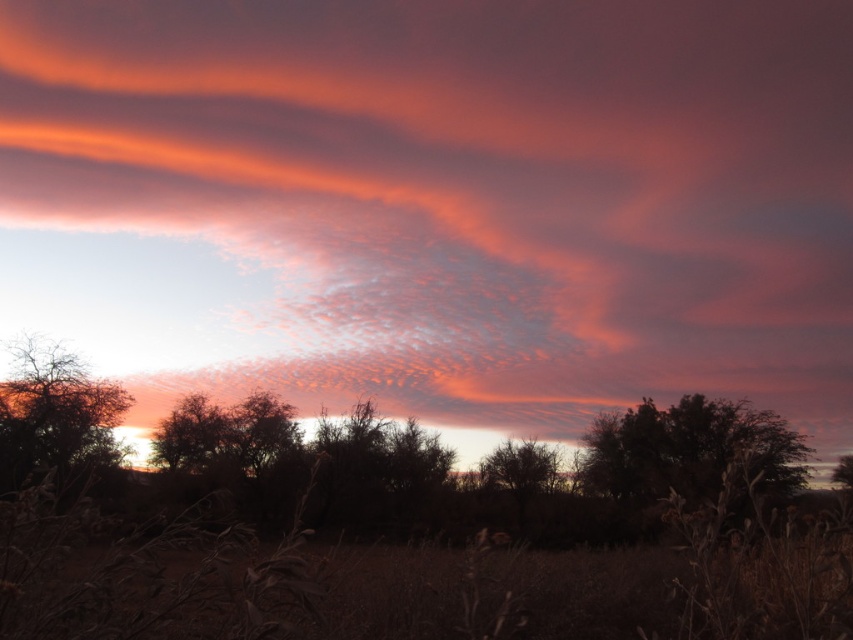
Can you confirm if silhouetted leafy tree at center is bigger than silhouette leafy tree at center?

Yes.

Is point (724, 442) positioned in front of point (207, 422)?

No, (724, 442) is behind (207, 422).

You are a GUI agent. You are given a task and a screenshot of the screen. Output one action in this format:
    pyautogui.click(x=<x>, y=<y>)
    Task: Click on the silhouetted leafy tree at center
    
    Given the screenshot: What is the action you would take?
    pyautogui.click(x=688, y=451)

Can you confirm if silhouette leafy tree at center is shorter than silhouette tree at center?

Incorrect, silhouette leafy tree at center's height does not fall short of silhouette tree at center's.

Between silhouette leafy tree at center and silhouette tree at center, which one appears on the left side from the viewer's perspective?

Positioned to the left is silhouette leafy tree at center.

The width and height of the screenshot is (853, 640). I want to click on silhouette leafy tree at center, so click(x=190, y=435).

Which is behind, point (795, 333) or point (675, 444)?

The point (795, 333) is more distant.

This screenshot has height=640, width=853. What do you see at coordinates (437, 205) in the screenshot?
I see `smooth orange cloud at upper center` at bounding box center [437, 205].

Where is `smooth orange cloud at upper center`? This screenshot has width=853, height=640. smooth orange cloud at upper center is located at coordinates (437, 205).